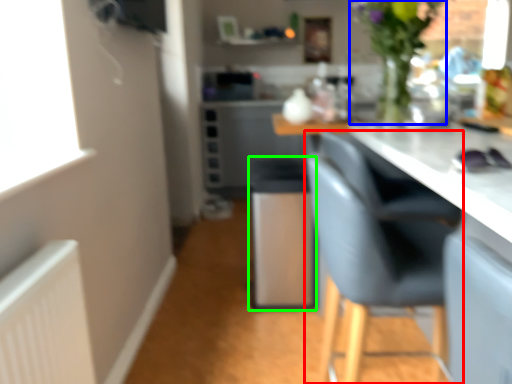
Question: Based on their relative distances, which object is nearer to chair (highlighted by a red box)? Choose from floral arrangement (highlighted by a blue box) and bar stool (highlighted by a green box).

Choices:
 (A) floral arrangement
 (B) bar stool

Answer: (A)